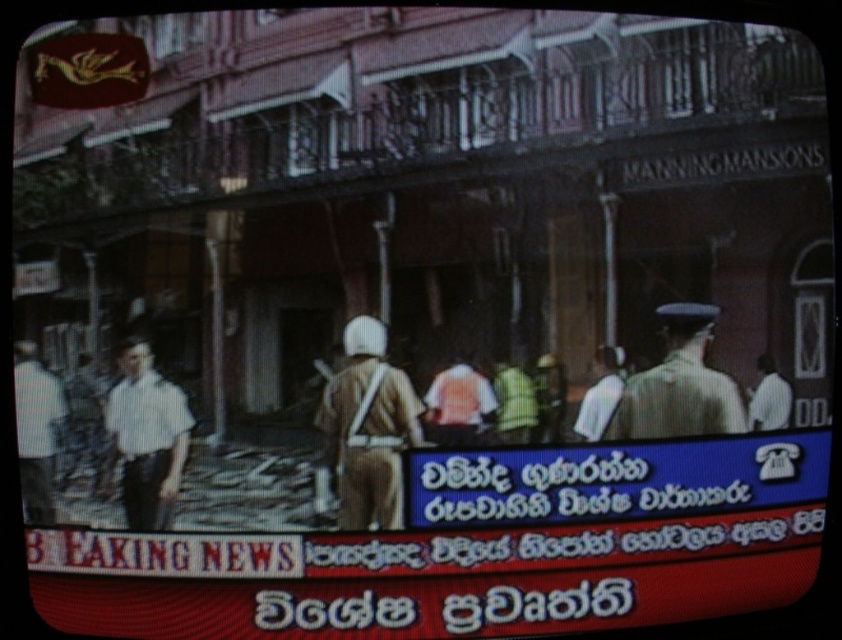
Is light brown uniform at center behind white shirt at left?

Yes.

Which is above, light brown uniform at center or white shirt at left?

light brown uniform at center

Which is in front, point (691, 412) or point (57, 417)?

Point (57, 417)

In order to click on light brown uniform at center in this screenshot , I will do `click(679, 385)`.

The width and height of the screenshot is (842, 640). Find the location of `brown fabric uniform at center`. brown fabric uniform at center is located at coordinates (368, 428).

The height and width of the screenshot is (640, 842). Describe the element at coordinates (368, 428) in the screenshot. I see `brown fabric uniform at center` at that location.

Locate an element on the screen. brown fabric uniform at center is located at coordinates [x=368, y=428].

Is brown fabric uniform at center bigger than white cotton shirt at left?

Yes, brown fabric uniform at center is bigger than white cotton shirt at left.

Who is taller, brown fabric uniform at center or white cotton shirt at left?

Standing taller between the two is brown fabric uniform at center.

Is point (382, 337) farther from camera compared to point (169, 442)?

That is False.

Find the location of a particular element. The image size is (842, 640). brown fabric uniform at center is located at coordinates (x=368, y=428).